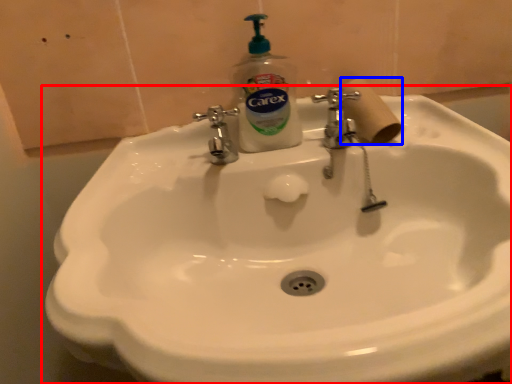
Question: Which of the following is the farthest to the observer, sink (highlighted by a red box) or toilet paper (highlighted by a blue box)?

Choices:
 (A) sink
 (B) toilet paper

Answer: (B)